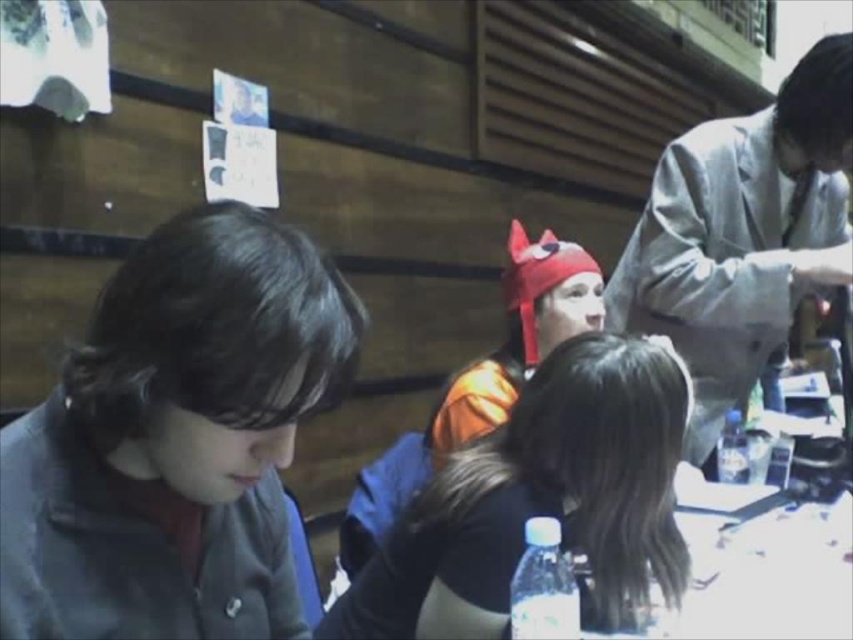
Is point (97, 600) behind point (570, 353)?

No.

Describe the element at coordinates (177, 438) in the screenshot. I see `dark gray fabric at left` at that location.

The width and height of the screenshot is (853, 640). What are the coordinates of `dark gray fabric at left` in the screenshot? It's located at (177, 438).

Between orange fabric mask at center and gray fabric suit at upper right, which one appears on the right side from the viewer's perspective?

gray fabric suit at upper right

What do you see at coordinates (544, 493) in the screenshot? I see `orange fabric mask at center` at bounding box center [544, 493].

You are a GUI agent. You are given a task and a screenshot of the screen. Output one action in this format:
    pyautogui.click(x=<x>, y=<y>)
    Task: Click on the orange fabric mask at center
    This screenshot has height=640, width=853.
    Given the screenshot: What is the action you would take?
    pyautogui.click(x=544, y=493)

Identify the location of orange fabric mask at center. (544, 493).

From the picture: Who is higher up, dark gray fabric at left or gray fabric suit at upper right?

gray fabric suit at upper right

Is dark gray fabric at left shorter than gray fabric suit at upper right?

Correct, dark gray fabric at left is not as tall as gray fabric suit at upper right.

Which is behind, point (222, 218) or point (756, 273)?

The point (756, 273) is more distant.

At what (x,y) coordinates should I click in order to perform the action: click on dark gray fabric at left. Please return your answer as a coordinate pair (x, y). The image size is (853, 640). Looking at the image, I should click on (177, 438).